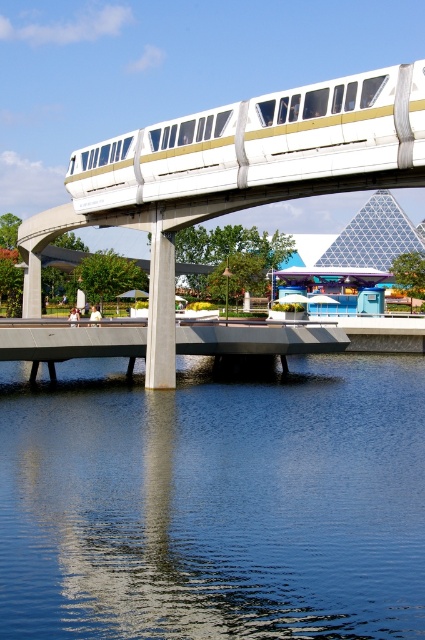
Between blue smooth water at center and white glossy monorail at upper center, which one appears on the right side from the viewer's perspective?

From the viewer's perspective, blue smooth water at center appears more on the right side.

Which of these two, blue smooth water at center or white glossy monorail at upper center, stands shorter?

blue smooth water at center

At what (x,y) coordinates should I click in order to perform the action: click on blue smooth water at center. Please return your answer as a coordinate pair (x, y). This screenshot has width=425, height=640. Looking at the image, I should click on (214, 502).